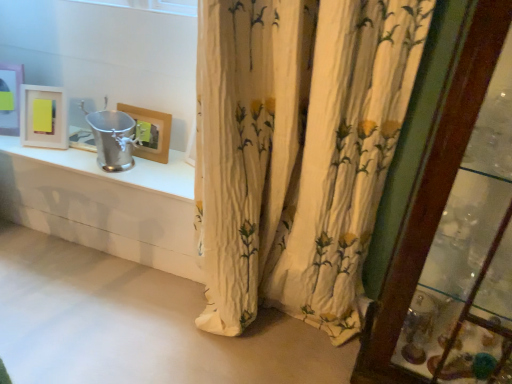
Identify the location of unoccupied area in front of matte wooden picture frame at upper center, the first picture frame in the right-to-left sequence. This screenshot has height=384, width=512. click(151, 179).